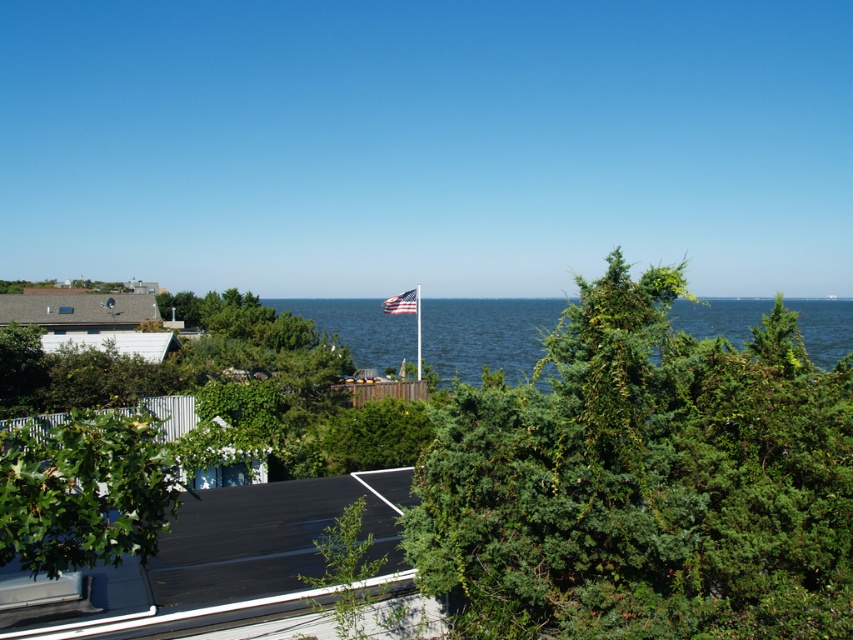
In the scene shown: You are a bird soaring above the coastal scene. You spot the green textured tree at center and the blue water at center. Which object would you see first as you fly towards the ground?

The green textured tree at center would be seen first because it is shorter than the blue water at center, meaning it is closer to the ground level.